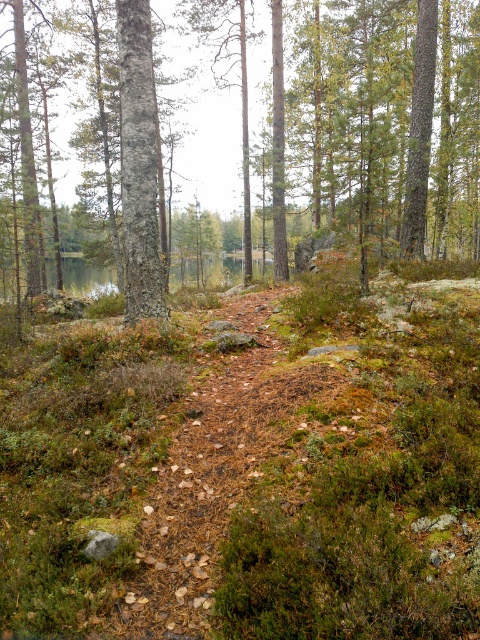
Question: Among these points, which one is farthest from the camera?

Choices:
 (A) coord(144,54)
 (B) coord(296,120)
 (C) coord(189,282)

Answer: (C)

Question: Is smooth gray bark tree at center positioned at the back of green mossy lake at center?

Choices:
 (A) no
 (B) yes

Answer: (A)

Question: Considering the real-world distances, which object is closest to the green mossy lake at center?

Choices:
 (A) smooth gray bark tree at center
 (B) brown bark tree at center

Answer: (B)

Question: Which point appears closest to the camera in this image?

Choices:
 (A) (90, 284)
 (B) (129, 291)
 (C) (360, 22)

Answer: (B)

Question: Considering the relative positions of brown bark tree at center and green mossy lake at center in the image provided, where is brown bark tree at center located with respect to green mossy lake at center?

Choices:
 (A) below
 (B) above

Answer: (B)

Question: Does brown bark tree at center have a smaller size compared to green mossy lake at center?

Choices:
 (A) no
 (B) yes

Answer: (A)